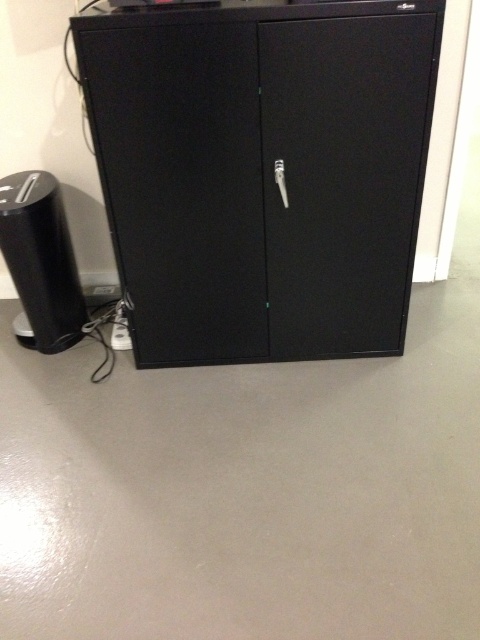
Question: Which object appears closest to the camera in this image?

Choices:
 (A) black matte speaker at left
 (B) matte black cabinet at center

Answer: (B)

Question: Does matte black cabinet at center appear under black matte speaker at left?

Choices:
 (A) yes
 (B) no

Answer: (B)

Question: Which of the following is the farthest from the observer?

Choices:
 (A) (254, 19)
 (B) (74, 316)

Answer: (B)

Question: Can you confirm if matte black cabinet at center is positioned to the right of black matte speaker at left?

Choices:
 (A) yes
 (B) no

Answer: (A)

Question: Which point is closer to the camera?

Choices:
 (A) (33, 278)
 (B) (170, 298)

Answer: (B)

Question: Is matte black cabinet at center wider than black matte speaker at left?

Choices:
 (A) yes
 (B) no

Answer: (A)